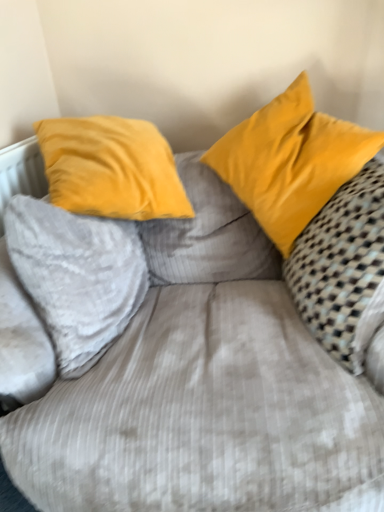
Question: Can you confirm if yellow velvet pillow at upper right, which is the second pillow in right-to-left order, is bigger than velvet yellow pillow at upper left, the 3th pillow in the right-to-left sequence?

Choices:
 (A) no
 (B) yes

Answer: (B)

Question: Considering the relative sizes of yellow velvet pillow at upper right, which is the second pillow in right-to-left order, and velvet yellow pillow at upper left, the 1th pillow when ordered from left to right, in the image provided, is yellow velvet pillow at upper right, which is the second pillow in right-to-left order, thinner than velvet yellow pillow at upper left, the 1th pillow when ordered from left to right,?

Choices:
 (A) yes
 (B) no

Answer: (B)

Question: From the image's perspective, is yellow velvet pillow at upper right, marked as the 2th pillow in a left-to-right arrangement, located beneath velvet yellow pillow at upper left, the 3th pillow in the right-to-left sequence?

Choices:
 (A) yes
 (B) no

Answer: (B)

Question: Could you tell me if yellow velvet pillow at upper right, marked as the 2th pillow in a left-to-right arrangement, is facing velvet yellow pillow at upper left, the 1th pillow when ordered from left to right?

Choices:
 (A) no
 (B) yes

Answer: (A)

Question: From a real-world perspective, is yellow velvet pillow at upper right, which is the second pillow in right-to-left order, located beneath velvet yellow pillow at upper left, the 3th pillow in the right-to-left sequence?

Choices:
 (A) yes
 (B) no

Answer: (B)

Question: Do you think velvet yellow pillow at right, the third pillow in the left-to-right sequence, is within velvet yellow pillow at upper left, the 1th pillow when ordered from left to right, or outside of it?

Choices:
 (A) inside
 (B) outside

Answer: (B)

Question: Does point (372, 181) appear closer or farther from the camera than point (64, 274)?

Choices:
 (A) closer
 (B) farther

Answer: (A)

Question: From the image's perspective, is velvet yellow pillow at right, which is the 1th pillow from right to left, located above or below velvet yellow pillow at upper left, the 1th pillow when ordered from left to right?

Choices:
 (A) below
 (B) above

Answer: (B)

Question: Looking at their shapes, would you say velvet yellow pillow at right, the third pillow in the left-to-right sequence, is wider or thinner than velvet yellow pillow at upper left, the 3th pillow in the right-to-left sequence?

Choices:
 (A) thin
 (B) wide

Answer: (A)

Question: Visually, is velvet yellow pillow at upper left, the 3th pillow in the right-to-left sequence, positioned to the left or to the right of velvet yellow pillow at right, the third pillow in the left-to-right sequence?

Choices:
 (A) right
 (B) left

Answer: (B)

Question: Is point (104, 278) positioned closer to the camera than point (292, 285)?

Choices:
 (A) closer
 (B) farther

Answer: (A)

Question: Is velvet yellow pillow at upper left, the 1th pillow when ordered from left to right, wider or thinner than velvet yellow pillow at right, which is the 1th pillow from right to left?

Choices:
 (A) wide
 (B) thin

Answer: (A)

Question: Considering the positions of velvet yellow pillow at upper left, the 1th pillow when ordered from left to right, and velvet yellow pillow at right, which is the 1th pillow from right to left, in the image, is velvet yellow pillow at upper left, the 1th pillow when ordered from left to right, taller or shorter than velvet yellow pillow at right, which is the 1th pillow from right to left,?

Choices:
 (A) tall
 (B) short

Answer: (B)

Question: Considering the positions of velvet yellow pillow at right, the third pillow in the left-to-right sequence, and yellow velvet pillow at upper right, which is the second pillow in right-to-left order, in the image, is velvet yellow pillow at right, the third pillow in the left-to-right sequence, bigger or smaller than yellow velvet pillow at upper right, which is the second pillow in right-to-left order,?

Choices:
 (A) small
 (B) big

Answer: (B)

Question: Looking at their shapes, would you say velvet yellow pillow at right, the third pillow in the left-to-right sequence, is wider or thinner than yellow velvet pillow at upper right, which is the second pillow in right-to-left order?

Choices:
 (A) wide
 (B) thin

Answer: (B)